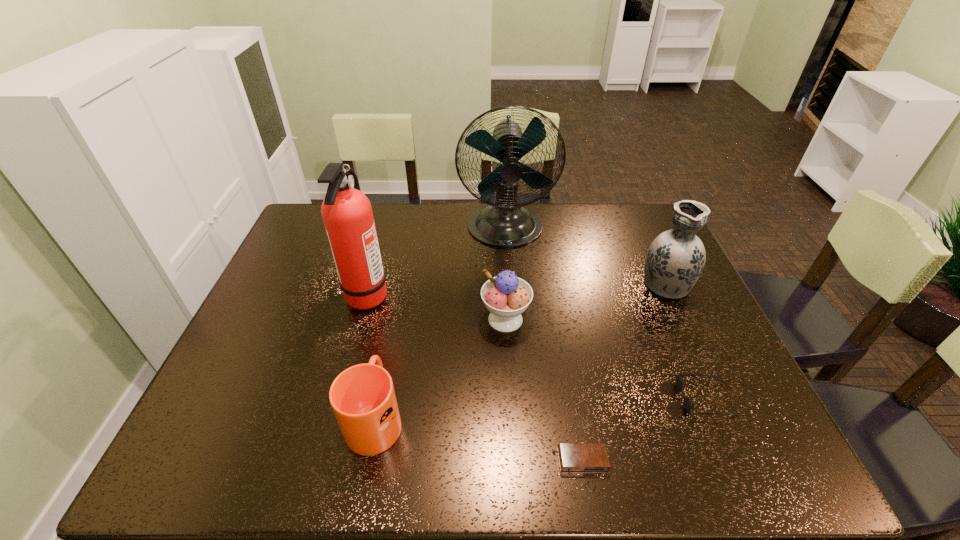
Locate an element on the screen. The height and width of the screenshot is (540, 960). empty space between the fifth shortest object and the farthest object is located at coordinates (586, 256).

Locate an element on the screen. empty space between the icecream and the fire extinguisher is located at coordinates (437, 307).

Identify the location of vacant region between the third tallest object and the shortest object. The width and height of the screenshot is (960, 540). (624, 372).

Locate an element on the screen. free space that is in between the vase and the shortest object is located at coordinates (624, 372).

Where is `vacant space that's between the fire extinguisher and the sixth tallest object`? The width and height of the screenshot is (960, 540). vacant space that's between the fire extinguisher and the sixth tallest object is located at coordinates (537, 346).

Identify the location of empty space between the sunglasses and the farthest object. Image resolution: width=960 pixels, height=540 pixels. (606, 314).

You are a GUI agent. You are given a task and a screenshot of the screen. Output one action in this format:
    pyautogui.click(x=<x>, y=<y>)
    Task: Click on the free area in between the icecream and the shortest object
    This screenshot has width=960, height=540.
    Given the screenshot: What is the action you would take?
    pyautogui.click(x=544, y=390)

Image resolution: width=960 pixels, height=540 pixels. I want to click on vacant region between the sunglasses and the vase, so (x=685, y=341).

The width and height of the screenshot is (960, 540). Identify the location of unoccupied area between the farthest object and the mug. (441, 323).

Image resolution: width=960 pixels, height=540 pixels. I want to click on object that is the fifth closest to the fire extinguisher, so click(676, 258).